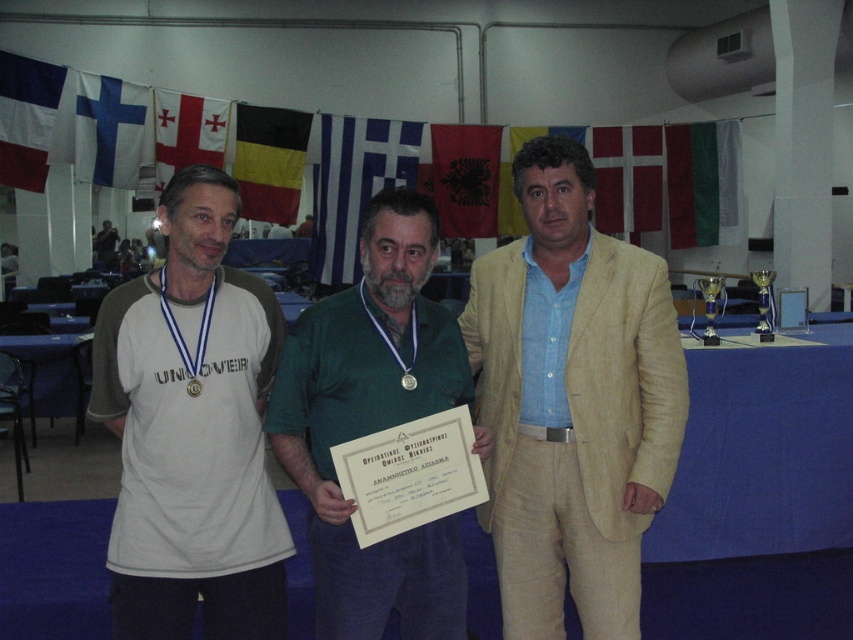
Is white cotton t-shirt at left smaller than yellow-black striped flag at upper center?

Yes, white cotton t-shirt at left is smaller than yellow-black striped flag at upper center.

Who is shorter, white cotton t-shirt at left or yellow-black striped flag at upper center?

With less height is yellow-black striped flag at upper center.

Locate an element on the screen. The width and height of the screenshot is (853, 640). white cotton t-shirt at left is located at coordinates (192, 429).

From the picture: Who is taller, white cotton t-shirt at left or blue fabric flag at center?

blue fabric flag at center

Is white cotton t-shirt at left thinner than blue fabric flag at center?

Yes, white cotton t-shirt at left is thinner than blue fabric flag at center.

This screenshot has height=640, width=853. I want to click on white cotton t-shirt at left, so click(x=192, y=429).

Identify the location of white cotton t-shirt at left. (192, 429).

Does beige linen suit at center appear on the right side of white cotton t-shirt at left?

Correct, you'll find beige linen suit at center to the right of white cotton t-shirt at left.

From the picture: Who is positioned more to the left, beige linen suit at center or white cotton t-shirt at left?

From the viewer's perspective, white cotton t-shirt at left appears more on the left side.

In order to click on beige linen suit at center in this screenshot , I will do `click(572, 403)`.